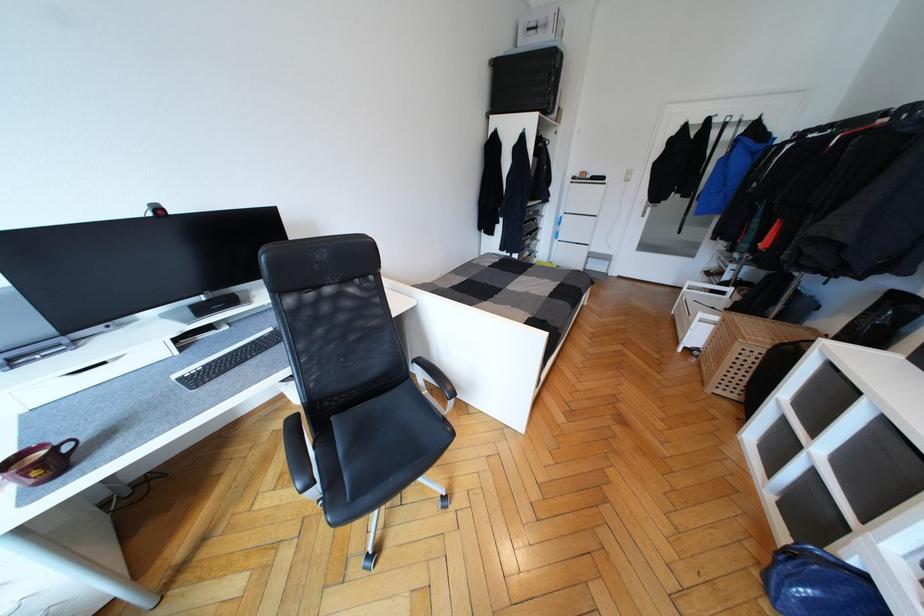
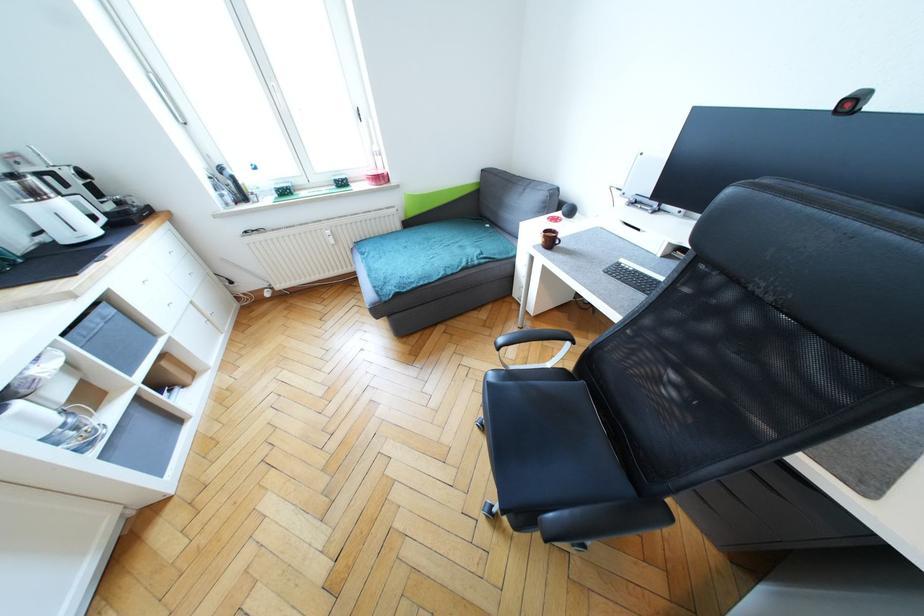
Locate, in the second image, the point that corresponds to (x=162, y=211) in the first image.

(857, 103)